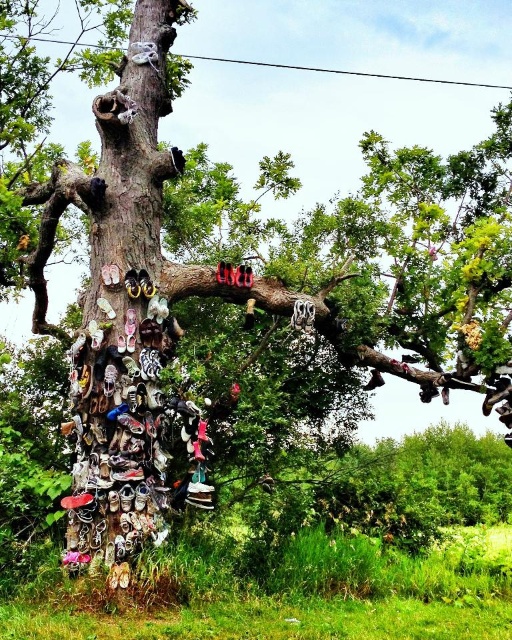
Question: Is shiny black sandals at left bigger than shiny black shoe at upper right?

Choices:
 (A) no
 (B) yes

Answer: (B)

Question: Can you confirm if shiny black sandals at left is bigger than shiny black shoe at upper right?

Choices:
 (A) no
 (B) yes

Answer: (B)

Question: Which point is farther to the camera?

Choices:
 (A) shiny black shoe at upper right
 (B) shiny black sandals at left

Answer: (A)

Question: Can you confirm if shiny black sandals at left is bigger than shiny black shoe at upper right?

Choices:
 (A) yes
 (B) no

Answer: (A)

Question: Which point is farther to the camera?

Choices:
 (A) shiny black shoe at upper right
 (B) shiny black sandals at left

Answer: (A)